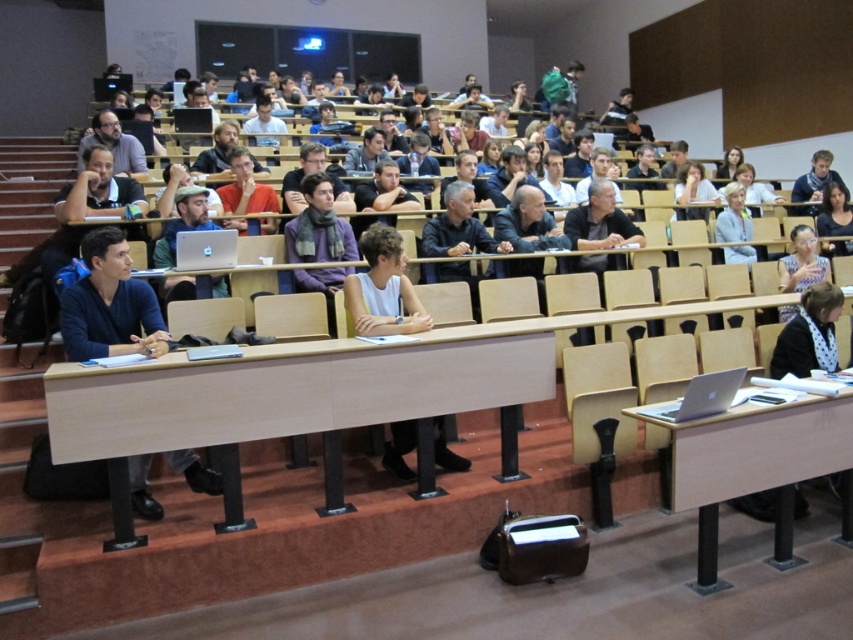
You are a student in the lecture hall and need to place your laptop on the nearest table. Which table should you choose between the light wood table at center and the silver metallic table at lower right?

The light wood table at center is positioned on the left side of the silver metallic table at lower right, so the silver metallic table at lower right is closer to you. You should choose the silver metallic table at lower right.

You are a student in the lecture hall and want to borrow a pen from the person wearing the dark gray shirt at center. Since you are sitting at the back row, can you reach the matte black laptop at center to grab the pen without moving your chair?

The dark gray shirt at center is smaller than the matte black laptop at center, so the laptop is larger and might block your reach. It is possible that you cannot easily reach the pen without moving your chair.